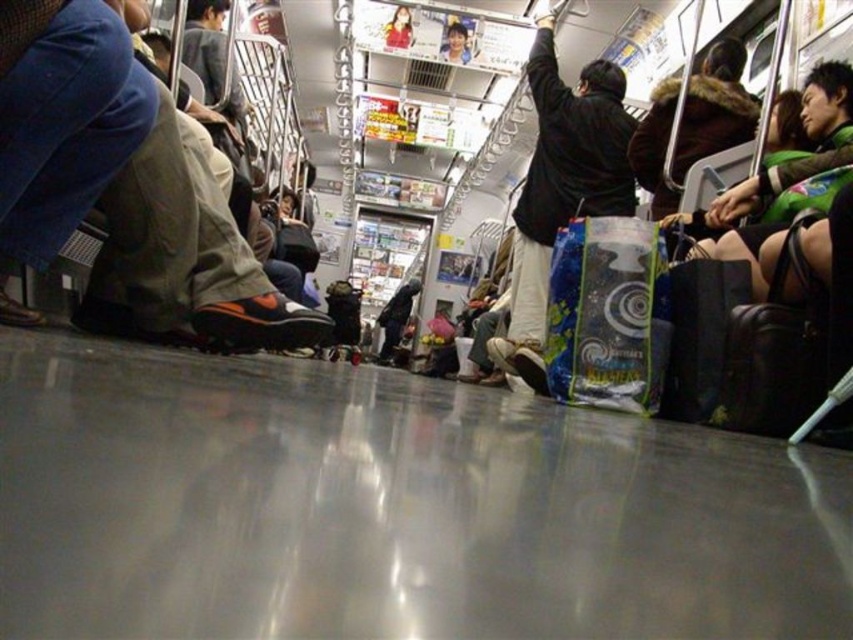
You are standing on the subway train floor and see two points marked on the floor. The first point is at coordinates point (136, 269) and the second is at point (525, 209). Which point is closer to you?

Point (136, 269) is in front of point (525, 209), so the first point is closer to you.

You are a passenger on the subway train and want to know if the orange suede shoe at lower left has a smaller width than the black matte jacket at upper center. Can you confirm this?

The orange suede shoe at lower left has a lesser width compared to the black matte jacket at upper center, so yes, the orange suede shoe at lower left is smaller in width than the black matte jacket at upper center.

In the scene shown: You are a passenger on the subway train and want to know if the orange suede shoe at lower left is taller than the black matte jacket at upper center. Can you determine this based on the scene?

The orange suede shoe at lower left is not as tall as the black matte jacket at upper center, so it is shorter.